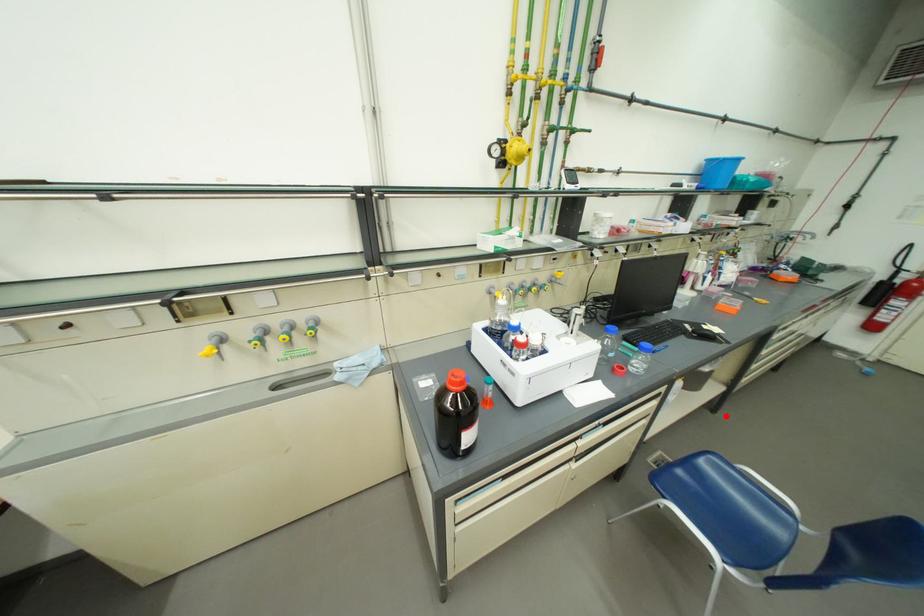
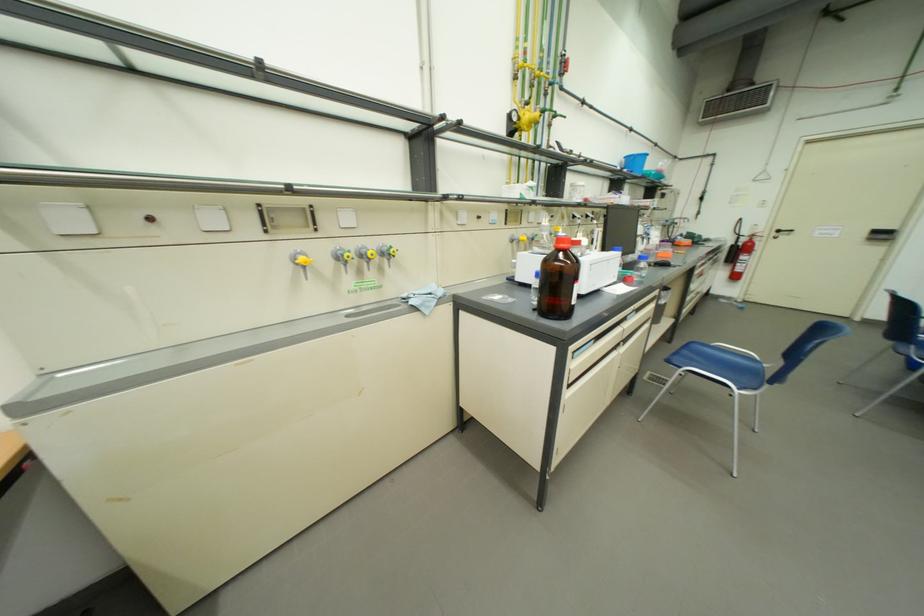
The point at the highlighted location is marked in the first image. Where is the corresponding point in the second image?

(681, 345)